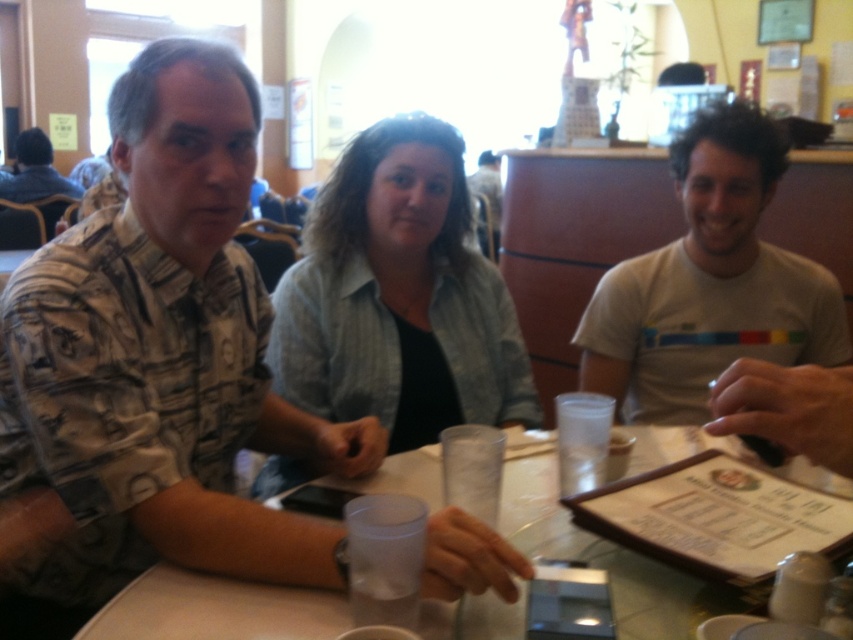
Question: Based on their relative distances, which object is farther from the matte black shirt at center?

Choices:
 (A) light blue denim shirt at center
 (B) gray cotton t-shirt at right
 (C) denim jacket at upper left

Answer: (A)

Question: Which is farther from the printed fabric shirt at left?

Choices:
 (A) light blue denim shirt at center
 (B) clear plastic cup at center
 (C) denim jacket at upper left
 (D) gray cotton t-shirt at right

Answer: (C)

Question: Can you confirm if clear plastic cup at center is smaller than denim jacket at upper left?

Choices:
 (A) yes
 (B) no

Answer: (A)

Question: Is printed fabric shirt at left to the right of clear plastic cup at center from the viewer's perspective?

Choices:
 (A) no
 (B) yes

Answer: (A)

Question: Does light blue denim shirt at center come behind denim jacket at upper left?

Choices:
 (A) no
 (B) yes

Answer: (A)

Question: Which is nearer to the gray cotton t-shirt at right?

Choices:
 (A) clear plastic cup at center
 (B) matte black shirt at center
 (C) denim jacket at upper left
 (D) light blue denim shirt at center

Answer: (D)